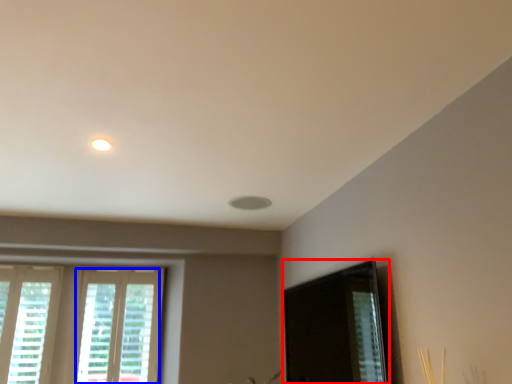
Question: Which object appears closest to the camera in this image, screen door (highlighted by a red box) or window (highlighted by a blue box)?

Choices:
 (A) screen door
 (B) window

Answer: (A)